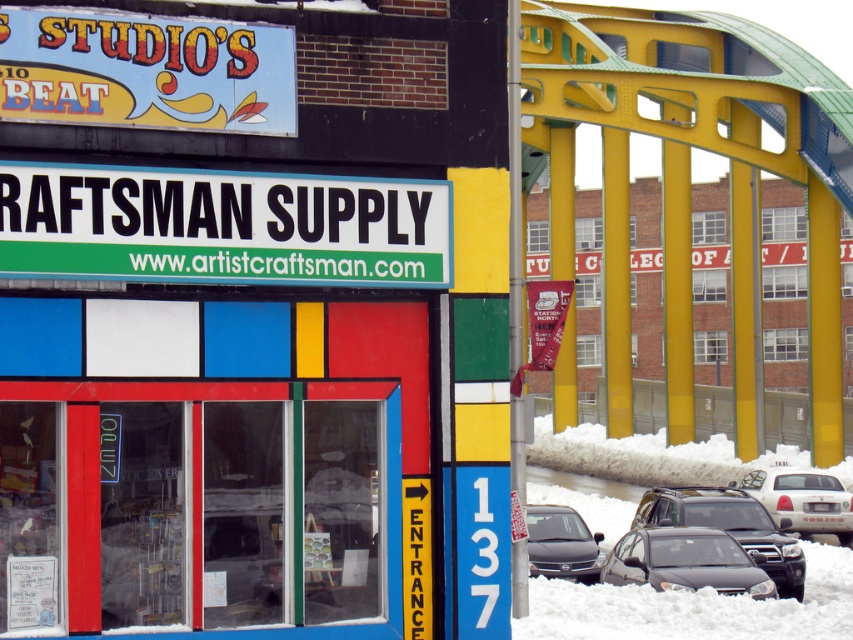
Which is in front, point (24, 189) or point (683, 536)?

Point (24, 189)

The image size is (853, 640). Identify the location of white plastic sign at upper center. point(222,225).

Does satin black sedan at lower center appear over white glossy taxi at lower right?

Actually, satin black sedan at lower center is below white glossy taxi at lower right.

Is point (654, 579) closer to camera compared to point (793, 513)?

Yes, it is.

Does point (761, 572) come in front of point (784, 472)?

Yes.

Locate an element on the screen. The height and width of the screenshot is (640, 853). satin black sedan at lower center is located at coordinates (685, 561).

Can you confirm if white plastic sign at upper center is thinner than matte black suv at lower right?

Yes, white plastic sign at upper center is thinner than matte black suv at lower right.

Looking at this image, can you confirm if white plastic sign at upper center is shorter than matte black suv at lower right?

Indeed, white plastic sign at upper center has a lesser height compared to matte black suv at lower right.

Where is `white plastic sign at upper center`? white plastic sign at upper center is located at coordinates (222, 225).